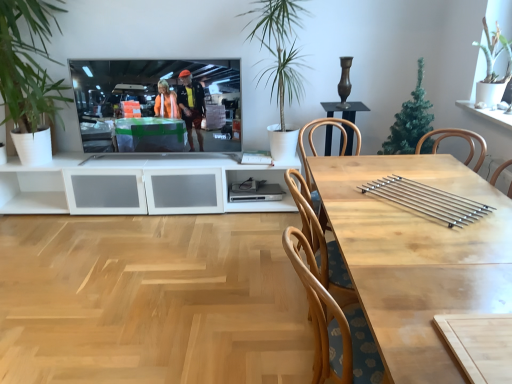
Question: Is silver metallic bars at center inside or outside of silver metallic television at center?

Choices:
 (A) inside
 (B) outside

Answer: (B)

Question: In the image, is silver metallic bars at center positioned in front of or behind silver metallic television at center?

Choices:
 (A) behind
 (B) front

Answer: (B)

Question: Based on their relative distances, which object is farther from the green leafy plant at left, which is counted as the 4th houseplant, starting from the right?

Choices:
 (A) green leafy plant at upper right, the first houseplant in the right-to-left sequence
 (B) silver metallic television at center
 (C) green leafy plant at upper center, acting as the 3th houseplant starting from the right
 (D) green artificial tree at upper right, acting as the 2th houseplant starting from the right
 (E) light wood table at center

Answer: (A)

Question: Which object is the closest to the silver metallic bars at center?

Choices:
 (A) silver metallic television at center
 (B) light wood table at center
 (C) green leafy plant at upper right, the fourth houseplant positioned from the left
 (D) green artificial tree at upper right, acting as the third houseplant starting from the left
 (E) green leafy plant at upper center, acting as the 3th houseplant starting from the right

Answer: (B)